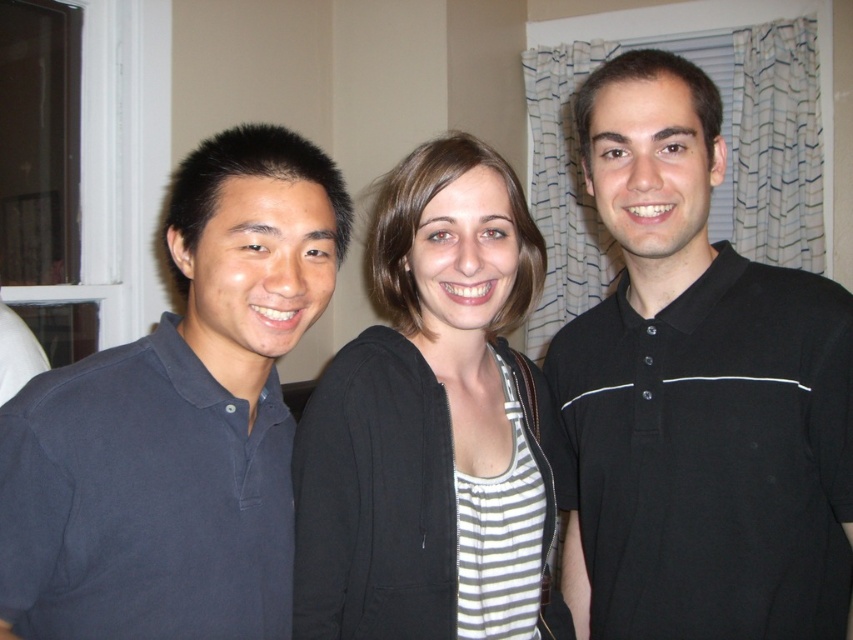
Based on the photo, can you confirm if dark blue polo shirt at left is positioned below black zip-up hoodie at center?

No.

Image resolution: width=853 pixels, height=640 pixels. I want to click on dark blue polo shirt at left, so click(x=178, y=420).

Who is more distant from viewer, (76, 424) or (413, 544)?

Point (413, 544)

At what (x,y) coordinates should I click in order to perform the action: click on dark blue polo shirt at left. Please return your answer as a coordinate pair (x, y). This screenshot has height=640, width=853. Looking at the image, I should click on (178, 420).

Is black matte shirt at center wider than black zip-up hoodie at center?

Incorrect, black matte shirt at center's width does not surpass black zip-up hoodie at center's.

Does black matte shirt at center have a greater height compared to black zip-up hoodie at center?

Indeed, black matte shirt at center has a greater height compared to black zip-up hoodie at center.

This screenshot has width=853, height=640. What are the coordinates of `black matte shirt at center` in the screenshot? It's located at (695, 396).

This screenshot has height=640, width=853. I want to click on black matte shirt at center, so coord(695,396).

Can you confirm if black matte shirt at center is positioned below dark blue polo shirt at left?

Actually, black matte shirt at center is above dark blue polo shirt at left.

Can you confirm if black matte shirt at center is wider than dark blue polo shirt at left?

Yes, black matte shirt at center is wider than dark blue polo shirt at left.

At what (x,y) coordinates should I click in order to perform the action: click on black matte shirt at center. Please return your answer as a coordinate pair (x, y). Looking at the image, I should click on (695, 396).